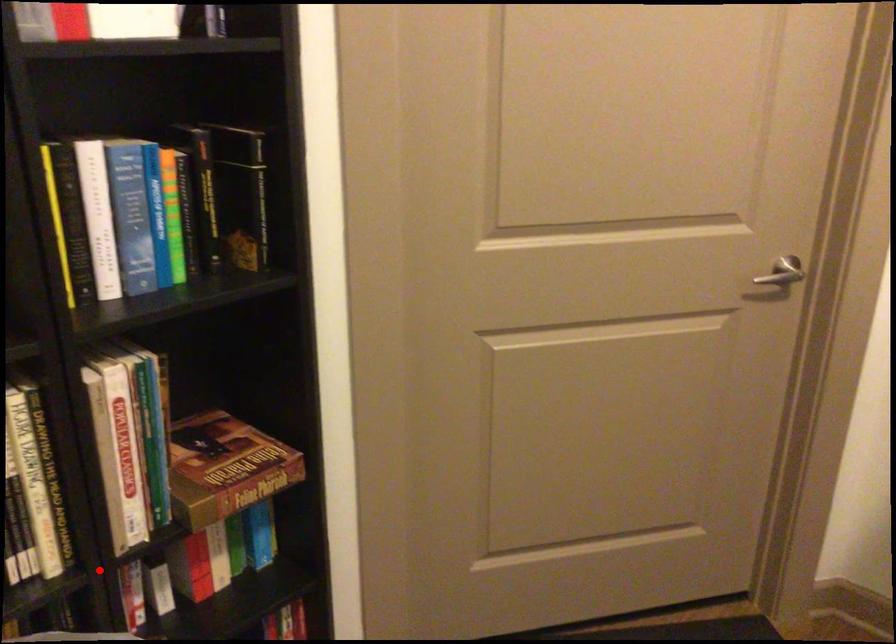
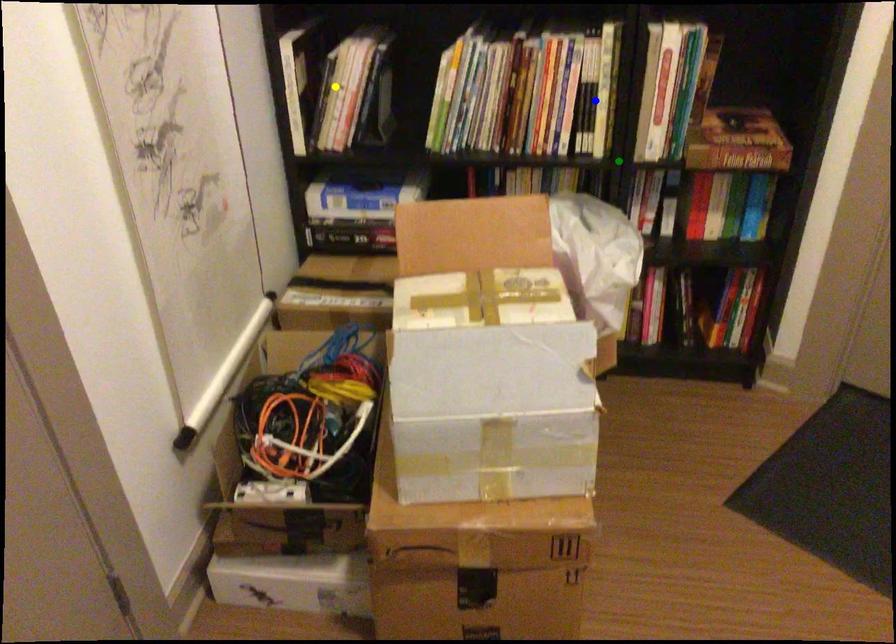
Question: I am providing you with two images of the same scene from different viewpoints. A red point is marked on the first image. You are given multiple points on the second image. Can you choose the point in image 2 that corresponds to the point in image 1?

Choices:
 (A) blue point
 (B) yellow point
 (C) green point

Answer: (C)